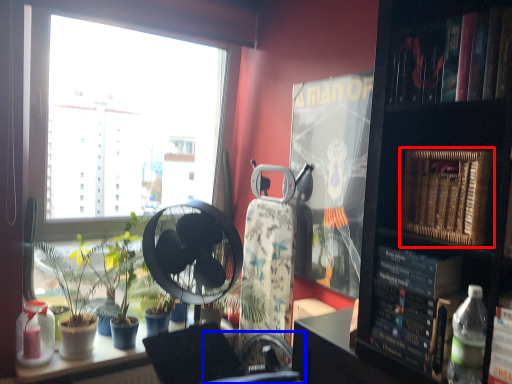
Question: Which object appears closest to the camera in this image, paperback book (highlighted by a red box) or swivel chair (highlighted by a blue box)?

Choices:
 (A) paperback book
 (B) swivel chair

Answer: (B)